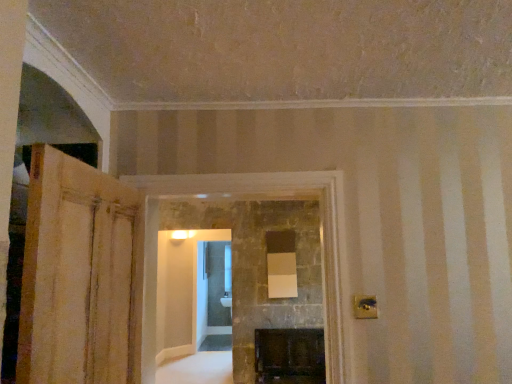
Question: Considering their positions, is wooden door at left located in front of or behind dark stone fireplace at center?

Choices:
 (A) front
 (B) behind

Answer: (A)

Question: Does point (129, 271) appear closer or farther from the camera than point (322, 218)?

Choices:
 (A) closer
 (B) farther

Answer: (A)

Question: Is wooden door at left inside or outside of dark stone fireplace at center?

Choices:
 (A) inside
 (B) outside

Answer: (B)

Question: In terms of width, does dark stone fireplace at center look wider or thinner when compared to wooden door at left?

Choices:
 (A) wide
 (B) thin

Answer: (A)

Question: Is dark stone fireplace at center inside the boundaries of wooden door at left, or outside?

Choices:
 (A) inside
 (B) outside

Answer: (B)

Question: From a real-world perspective, relative to wooden door at left, is dark stone fireplace at center vertically above or below?

Choices:
 (A) above
 (B) below

Answer: (A)

Question: Is point coord(325,254) positioned closer to the camera than point coord(132,286)?

Choices:
 (A) closer
 (B) farther

Answer: (B)